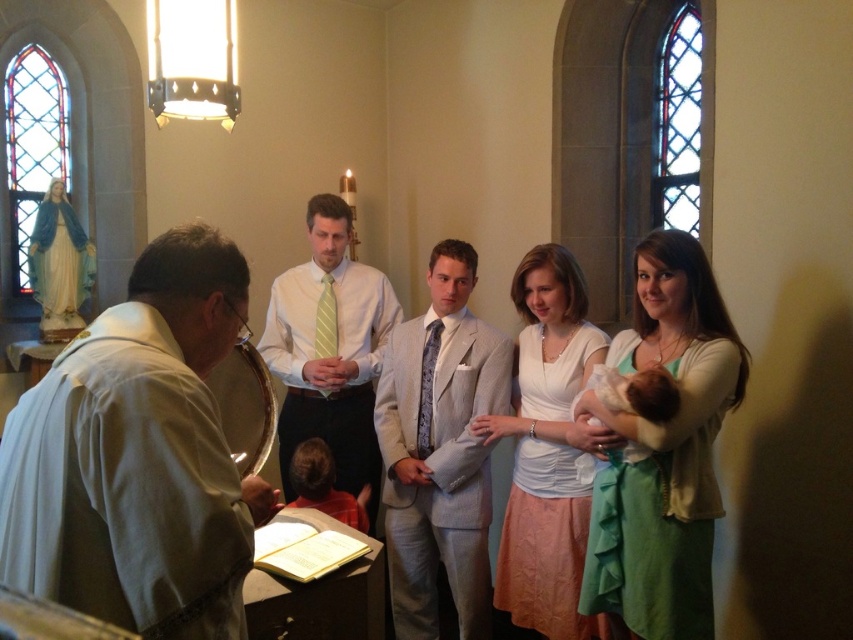
Is point (426, 516) positioned in front of point (622, 392)?

No, it is behind (622, 392).

Looking at this image, does light gray suit at center come behind soft white fabric at center?

Yes, it is behind soft white fabric at center.

What are the coordinates of `light gray suit at center` in the screenshot? It's located at (440, 451).

Does soft white fabric at center have a greater height compared to orange fabric shirt at lower left?

Incorrect, soft white fabric at center's height is not larger of orange fabric shirt at lower left's.

Who is shorter, soft white fabric at center or orange fabric shirt at lower left?

Standing shorter between the two is soft white fabric at center.

Does point (622, 452) come in front of point (296, 476)?

Yes, it is.

Locate an element on the screen. The height and width of the screenshot is (640, 853). soft white fabric at center is located at coordinates (637, 392).

Measure the distance between point (201, 444) and camera.

Point (201, 444) is 1.21 meters away from camera.

Which is in front, point (164, 477) or point (357, 422)?

Positioned in front is point (164, 477).

Who is more forward, (x=167, y=410) or (x=322, y=266)?

Point (x=167, y=410) is in front.

Identify the location of white cloth at left. Image resolution: width=853 pixels, height=640 pixels. (138, 456).